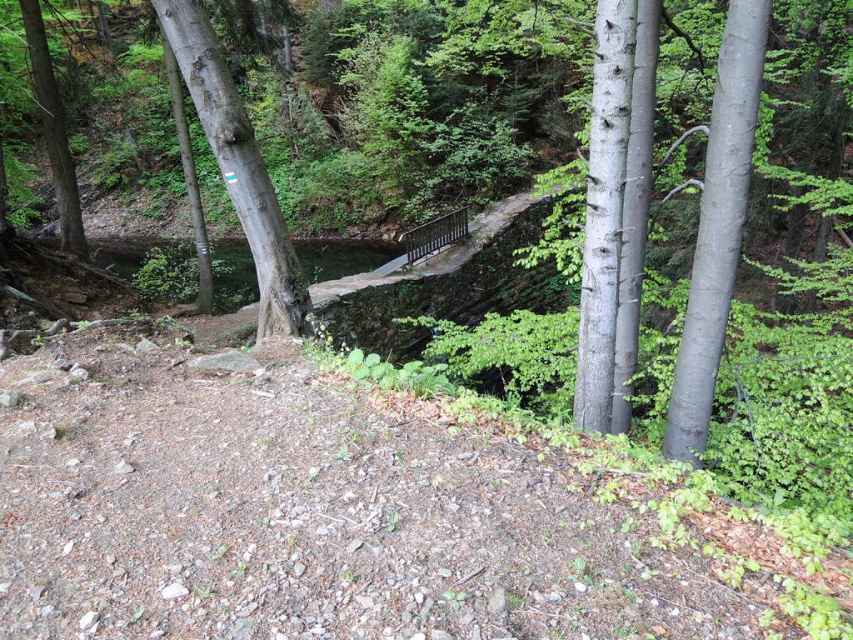
Question: Considering the relative positions of smooth gray tree at right and smooth gray bark tree at center in the image provided, where is smooth gray tree at right located with respect to smooth gray bark tree at center?

Choices:
 (A) above
 (B) below

Answer: (B)

Question: Is smooth gray tree at right smaller than green matte tree at left?

Choices:
 (A) yes
 (B) no

Answer: (A)

Question: Which point is closer to the camera taking this photo?

Choices:
 (A) (717, 356)
 (B) (33, 76)
 (C) (287, 268)

Answer: (A)

Question: Which of the following is the farthest from the observer?

Choices:
 (A) pos(238,161)
 (B) pos(57,93)
 (C) pos(729,259)

Answer: (B)

Question: Is smooth gray bark tree at center positioned before green matte tree at left?

Choices:
 (A) yes
 (B) no

Answer: (A)

Question: Considering the real-world distances, which object is closest to the smooth gray tree at right?

Choices:
 (A) smooth gray bark tree at center
 (B) green matte tree at left

Answer: (A)